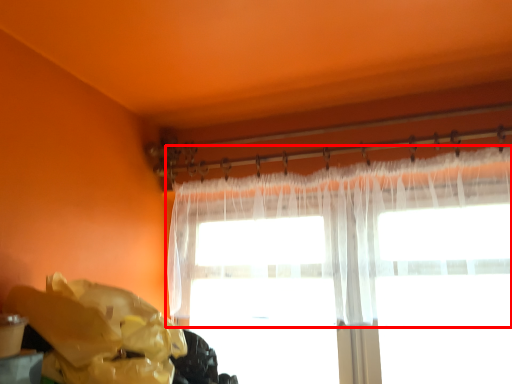
Question: From the image's perspective, where is curtain (annotated by the red box) located relative to waste?

Choices:
 (A) above
 (B) below

Answer: (A)